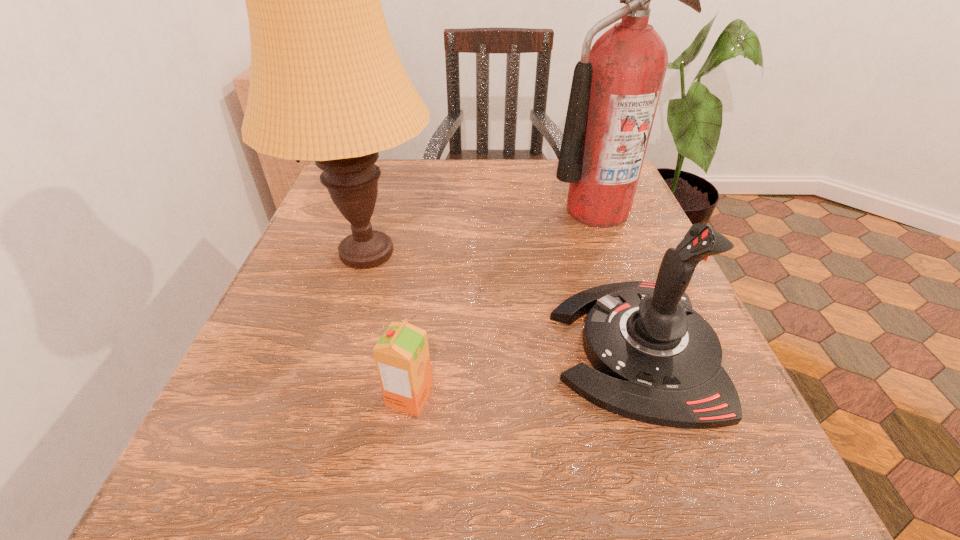
I want to click on fire extinguisher, so click(616, 86).

Find the location of a particular element. The height and width of the screenshot is (540, 960). lampshade is located at coordinates (327, 85).

Where is `the second shortest object`? The image size is (960, 540). the second shortest object is located at coordinates (658, 361).

Where is `orange juice`? This screenshot has height=540, width=960. orange juice is located at coordinates (402, 358).

At what (x,y) coordinates should I click in order to perform the action: click on vacant area situated on the front of the fire extinguisher near the operation label. Please return your answer as a coordinate pair (x, y). Looking at the image, I should click on (613, 259).

Find the location of a particular element. Image resolution: width=960 pixels, height=540 pixels. blank space located on the front of the lampshade is located at coordinates (331, 367).

The image size is (960, 540). What are the coordinates of `free space located 0.230m on the handle side of the joystick` in the screenshot? It's located at (405, 348).

You are a GUI agent. You are given a task and a screenshot of the screen. Output one action in this format:
    pyautogui.click(x=<x>, y=<y>)
    Task: Click on the blank space located 0.200m on the handle side of the joystick
    
    Given the screenshot: What is the action you would take?
    pyautogui.click(x=425, y=348)

At what (x,y) coordinates should I click in order to perform the action: click on vacant region located on the handle side of the joystick. Please return your answer as a coordinate pair (x, y). Looking at the image, I should click on (464, 348).

The height and width of the screenshot is (540, 960). What are the coordinates of `free space located on the right of the orange juice` in the screenshot? It's located at (518, 397).